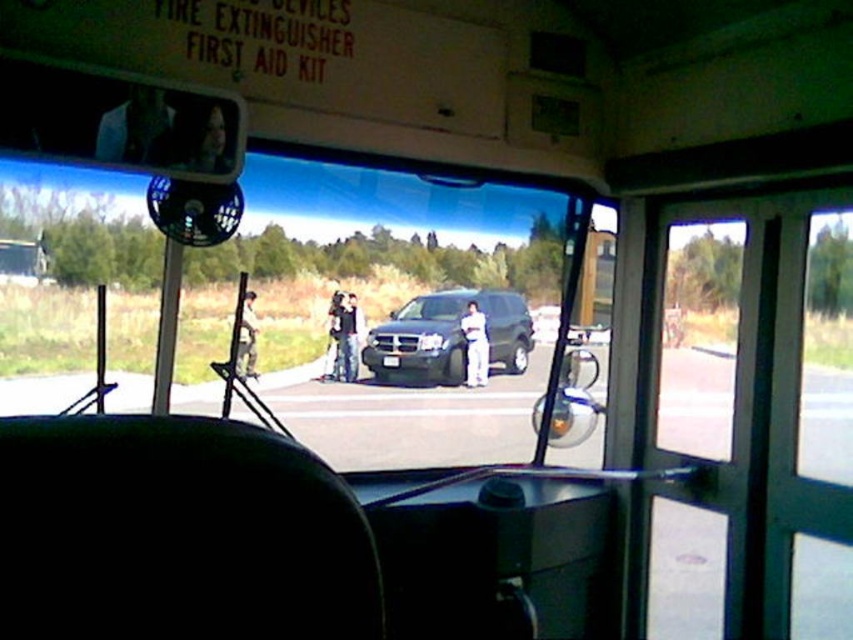
Measure the distance between metallic dark green suv at center and white cotton pants at center.

metallic dark green suv at center and white cotton pants at center are 9.37 inches apart.

Is the position of metallic dark green suv at center less distant than that of white cotton pants at center?

Yes, metallic dark green suv at center is in front of white cotton pants at center.

Measure the distance between point (409, 340) and camera.

The distance of point (409, 340) from camera is 19.92 feet.

The image size is (853, 640). Identify the location of metallic dark green suv at center. (447, 337).

Is white cotton pants at center positioned before camouflage fabric jacket at center?

No, white cotton pants at center is behind camouflage fabric jacket at center.

Does point (465, 337) come farther from viewer compared to point (254, 316)?

Yes.

You are a GUI agent. You are given a task and a screenshot of the screen. Output one action in this format:
    pyautogui.click(x=<x>, y=<y>)
    Task: Click on the white cotton pants at center
    
    Given the screenshot: What is the action you would take?
    pyautogui.click(x=474, y=346)

Can you confirm if denim pants at center is smaller than camouflage fabric jacket at center?

No.

This screenshot has height=640, width=853. I want to click on denim pants at center, so click(x=351, y=337).

At what (x,y) coordinates should I click in order to perform the action: click on denim pants at center. Please return your answer as a coordinate pair (x, y). This screenshot has width=853, height=640. Looking at the image, I should click on (351, 337).